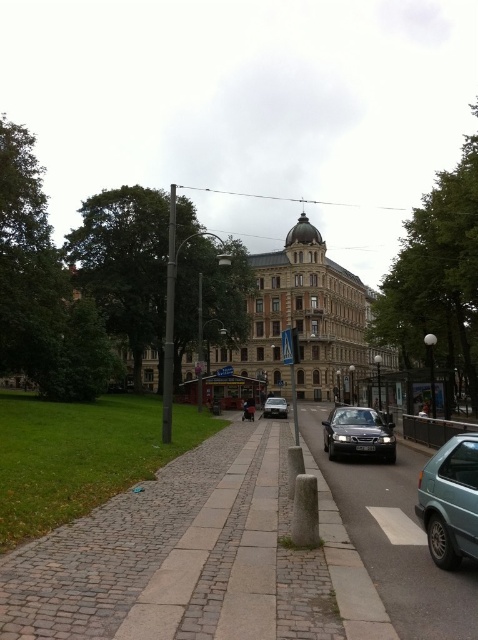
Question: Which point is farther from the camera taking this photo?

Choices:
 (A) (267, 397)
 (B) (394, 612)

Answer: (A)

Question: Can you confirm if teal matte hatchback at right is positioned to the right of silver metallic van at center?

Choices:
 (A) yes
 (B) no

Answer: (A)

Question: Does teal matte hatchback at right have a larger size compared to silver metallic van at center?

Choices:
 (A) no
 (B) yes

Answer: (A)

Question: Estimate the real-world distances between objects in this image. Which object is farther from the silver metallic van at center?

Choices:
 (A) gray concrete pavement at center
 (B) teal matte hatchback at right
 (C) shiny black car at center

Answer: (B)

Question: Among these points, which one is farthest from the camera?

Choices:
 (A) (433, 586)
 (B) (376, 417)
 (C) (262, 416)
 (D) (433, 532)

Answer: (C)

Question: Is gray concrete pavement at center to the right of teal matte hatchback at right from the viewer's perspective?

Choices:
 (A) yes
 (B) no

Answer: (B)